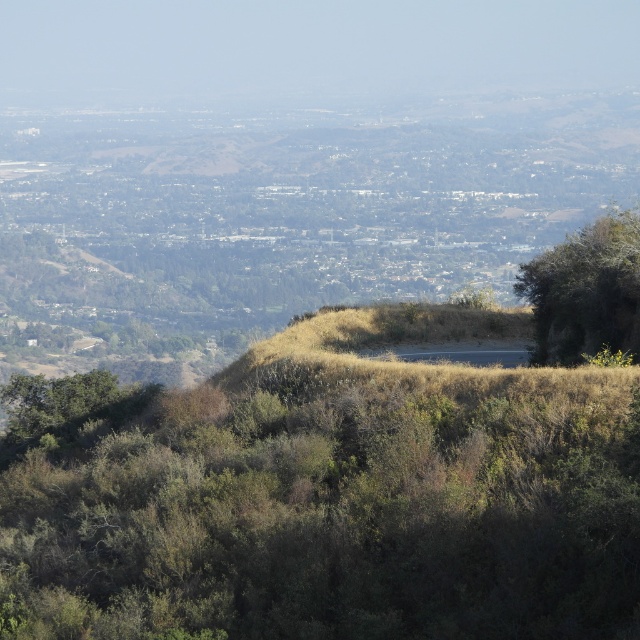
Question: Is green leafy shrub at center positioned before green leafy tree at right?

Choices:
 (A) no
 (B) yes

Answer: (B)

Question: Is green leafy shrub at center positioned before green leafy tree at right?

Choices:
 (A) no
 (B) yes

Answer: (B)

Question: Is green leafy shrub at center bigger than green leafy tree at right?

Choices:
 (A) no
 (B) yes

Answer: (B)